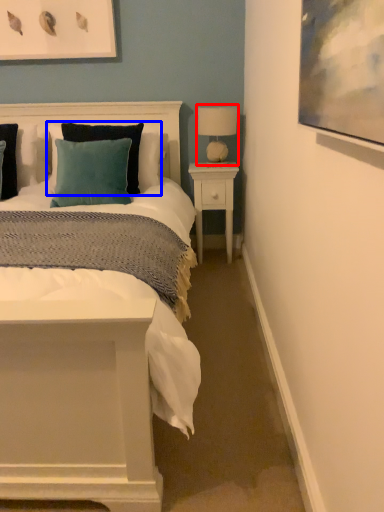
Question: Among these objects, which one is farthest to the camera, table lamp (highlighted by a red box) or pillow (highlighted by a blue box)?

Choices:
 (A) table lamp
 (B) pillow

Answer: (A)